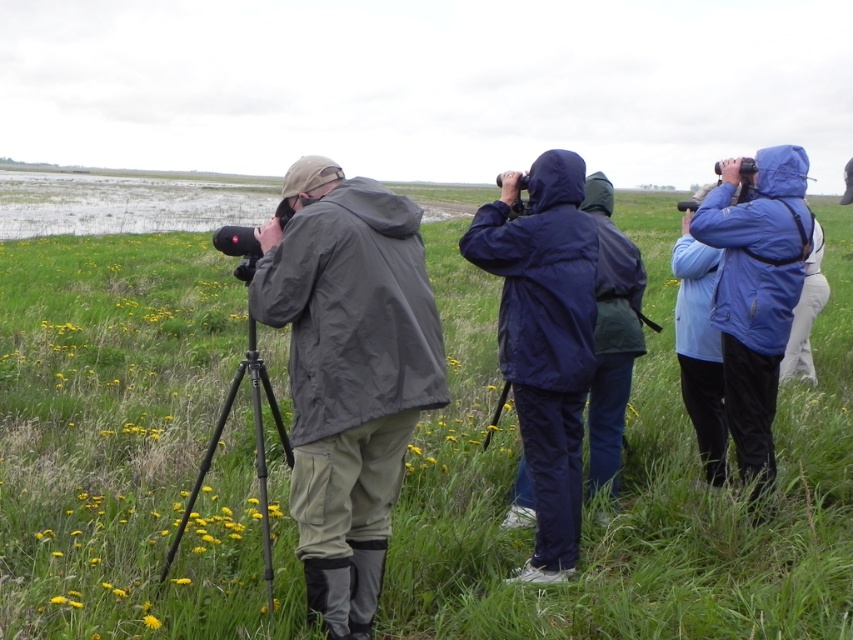
You are a photographer trying to capture a wide shot of the green grassy at center and the blue matte jacket at right. Given their sizes, which object should you focus on to ensure both are clearly visible in the frame?

Since the green grassy at center is larger than the blue matte jacket at right, you should focus on the green grassy at center to ensure both objects are clearly visible in the frame.

You are a photographer trying to capture a bird in the distance. You notice two people in the foreground wearing jackets. One is wearing a matte black jacket at center and the other a blue matte jacket at right. Which jacket is shorter in height?

The matte black jacket at center has a lesser height compared to the blue matte jacket at right, so the matte black jacket at center is shorter.

You are standing at the center of the grassy field and want to locate the navy blue raincoat at center. According to the coordinates provided, in which direction should you move relative to your current position?

The navy blue raincoat at center is located at coordinates approximately 0.530 on the x axis and 0.639 on the y axis. Since you are at the center of the field, which would be coordinates (426, 320), you should move slightly to the right and forward to reach the navy blue raincoat at center.